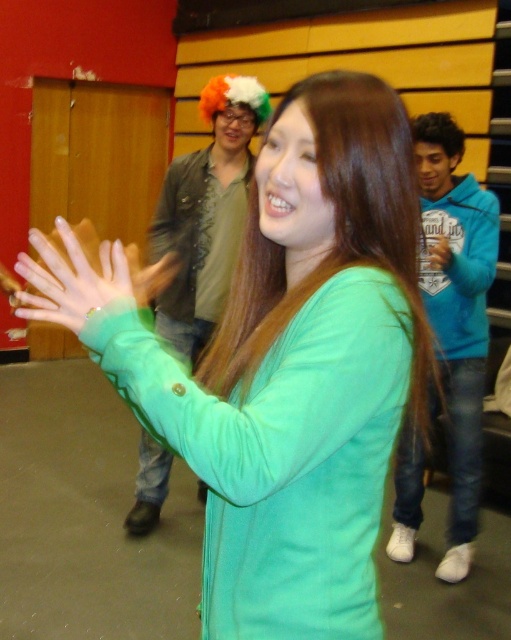
You are standing at the point marked as point (x=81, y=300) and want to reach the door located at the opposite side of the room. The minimum distance you can move is 35 inches. Will you be able to reach the door without moving more than the minimum distance?

The distance between you and the door is 34.72 inches, which is less than the minimum required distance of 35 inches. Therefore, you will not be able to reach the door without moving more than the minimum distance.